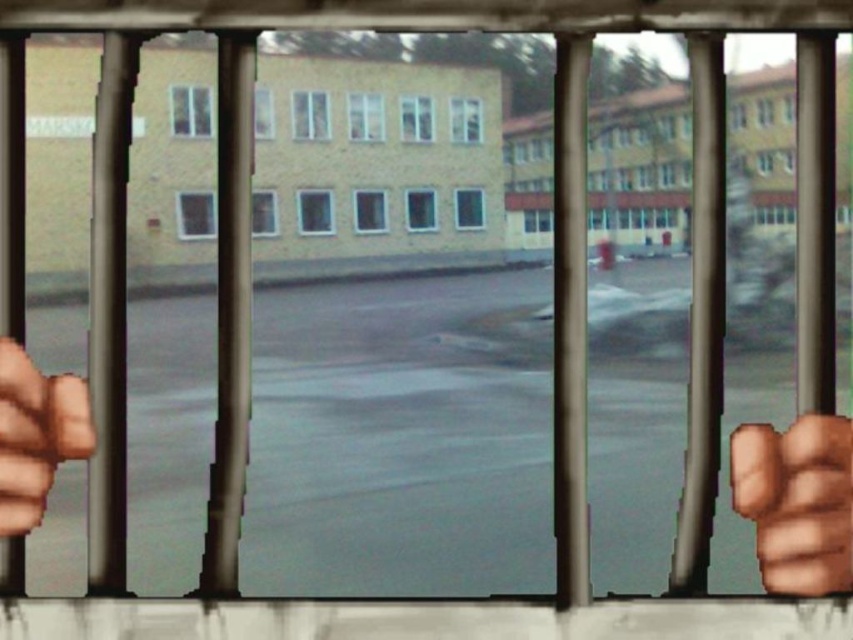
You are an observer inside a confined space looking through barred window. You see a brown leather fist at right and a brown leather hand at left. Which object is closer to the bars?

The brown leather fist at right is closer to the bars because it is positioned under the brown leather hand at left, indicating it is in front.

From the picture: You are an inmate in a prison cell. You notice two items through the window bars. One is a brown leather fist at right and the other is a brown leather hand at left. Which item is closer to the window bars?

The brown leather fist at right is closer to the window bars because it is shorter than the brown leather hand at left, meaning it is positioned nearer to the observer.

You are standing inside a cell with a barred window. You notice two points marked on the window glass. The first point is at coordinates point (776, 438), and the second is at point (22, 428). From your perspective inside the cell, which point is closer to you?

Point (22, 428) is closer to you because the point (776, 438) is behind it.